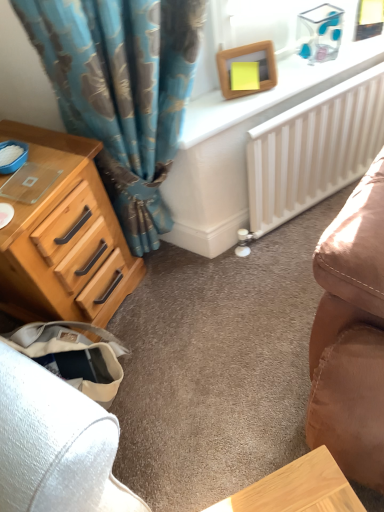
Question: Is white glossy radiator at upper center at the back of white matte radiator at center-right?

Choices:
 (A) yes
 (B) no

Answer: (A)

Question: From a real-world perspective, is white matte radiator at center-right below white glossy radiator at upper center?

Choices:
 (A) no
 (B) yes

Answer: (B)

Question: From the image's perspective, is white matte radiator at center-right over white glossy radiator at upper center?

Choices:
 (A) yes
 (B) no

Answer: (B)

Question: Considering the relative sizes of white matte radiator at center-right and white glossy radiator at upper center in the image provided, is white matte radiator at center-right bigger than white glossy radiator at upper center?

Choices:
 (A) yes
 (B) no

Answer: (B)

Question: Considering the relative sizes of white matte radiator at center-right and white glossy radiator at upper center in the image provided, is white matte radiator at center-right smaller than white glossy radiator at upper center?

Choices:
 (A) no
 (B) yes

Answer: (B)

Question: Could you tell me if white matte radiator at center-right is facing white glossy radiator at upper center?

Choices:
 (A) yes
 (B) no

Answer: (A)

Question: Considering the relative sizes of light brown wood chest of drawers at left and white glossy radiator at upper center in the image provided, is light brown wood chest of drawers at left wider than white glossy radiator at upper center?

Choices:
 (A) yes
 (B) no

Answer: (A)

Question: Can you confirm if light brown wood chest of drawers at left is positioned to the right of white glossy radiator at upper center?

Choices:
 (A) yes
 (B) no

Answer: (B)

Question: Is the depth of light brown wood chest of drawers at left less than that of white glossy radiator at upper center?

Choices:
 (A) no
 (B) yes

Answer: (B)

Question: Does light brown wood chest of drawers at left have a lesser width compared to white glossy radiator at upper center?

Choices:
 (A) no
 (B) yes

Answer: (A)

Question: Is light brown wood chest of drawers at left not within white glossy radiator at upper center?

Choices:
 (A) yes
 (B) no

Answer: (A)

Question: Is light brown wood chest of drawers at left facing towards white glossy radiator at upper center?

Choices:
 (A) yes
 (B) no

Answer: (B)

Question: Considering the relative sizes of white matte radiator at center-right and wooden picture frame at upper center in the image provided, is white matte radiator at center-right bigger than wooden picture frame at upper center?

Choices:
 (A) yes
 (B) no

Answer: (A)